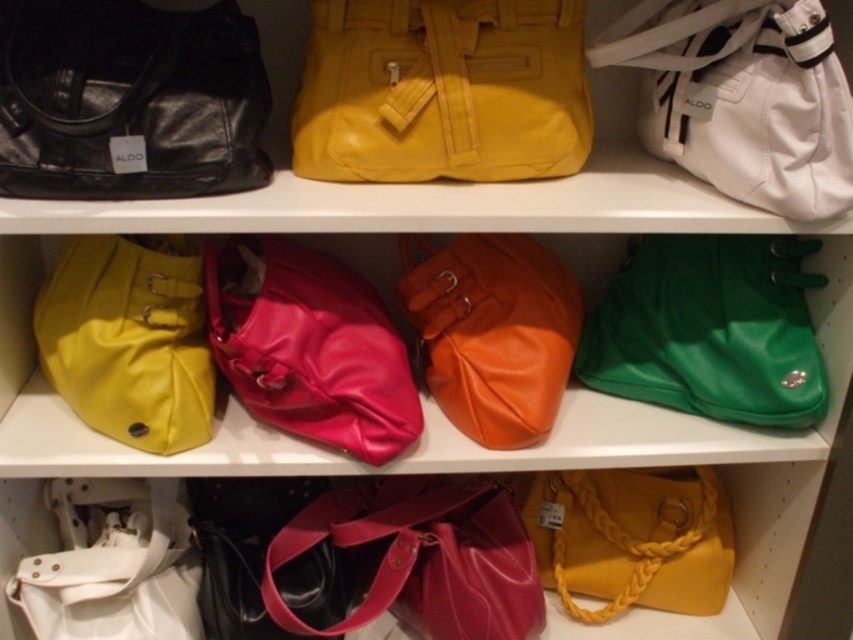
You are a store employee arranging handbags on a shelf. You have a shiny pink purse at center and a white leather handbag at lower left. If you want to place a new small accessory next to the smaller of the two, which handbag should you choose?

The white leather handbag at lower left is smaller than the shiny pink purse at center, so you should place the new small accessory next to the white leather handbag at lower left.

You are standing in front of the handbag display. There are two points marked on the middle shelf. The first point is at coordinates point (511, 104) and the second is at point (518, 356). Which point is closer to you?

Point (511, 104) is in front of point (518, 356), so it is closer to you.

You are standing in a store looking at the handbags displayed on white shelves. You want to reach the matte yellow leather handbag at upper center. The store has a rule that you must stay at least 30 inches away from the shelves. Can you safely reach the handbag without violating the store rule?

The matte yellow leather handbag at upper center is 33.39 inches away from the viewer. Since the store requires staying at least 30 inches away, you can safely reach it while maintaining the required distance as 33.39 inches is more than 30 inches.